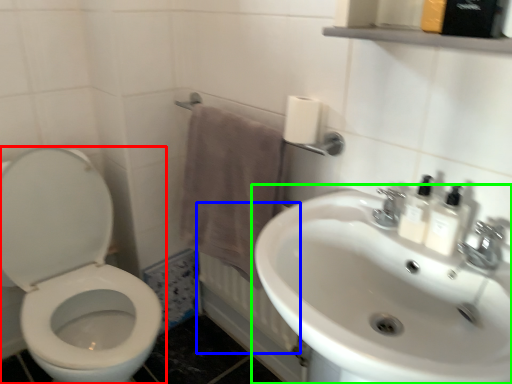
Question: Estimate the real-world distances between objects in this image. Which object is closer to toilet (highlighted by a red box), radiator (highlighted by a blue box) or sink (highlighted by a green box)?

Choices:
 (A) radiator
 (B) sink

Answer: (A)